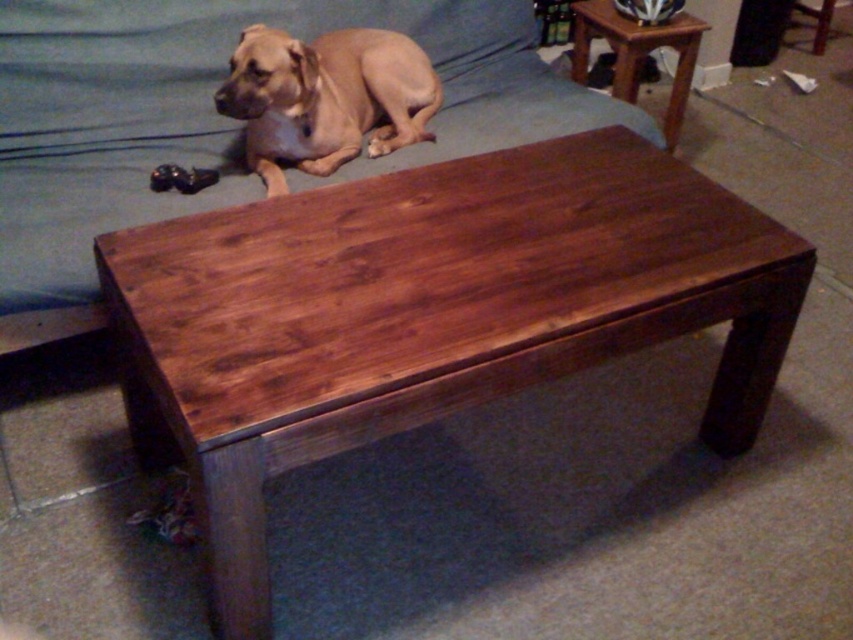
Is point (357, 426) positioned before point (386, 131)?

Yes, point (357, 426) is closer to viewer.

Between point (660, 330) and point (282, 65), which one is positioned behind?

Positioned behind is point (282, 65).

Measure the distance between dark brown wood table at center and camera.

dark brown wood table at center is 1.10 meters away from camera.

Image resolution: width=853 pixels, height=640 pixels. In order to click on dark brown wood table at center in this screenshot , I will do coord(426,314).

Between point (364, 349) and point (9, 140), which one is positioned in front?

Positioned in front is point (364, 349).

Is dark brown wood table at center to the right of brown wood couch at center from the viewer's perspective?

Correct, you'll find dark brown wood table at center to the right of brown wood couch at center.

Which is in front, point (231, 509) or point (12, 156)?

Point (231, 509)

Find the location of a particular element. This screenshot has width=853, height=640. dark brown wood table at center is located at coordinates (426, 314).

Does light brown fur at upper center have a lesser height compared to mahogany wood side table at upper right?

Yes, light brown fur at upper center is shorter than mahogany wood side table at upper right.

Who is higher up, light brown fur at upper center or mahogany wood side table at upper right?

mahogany wood side table at upper right

Does point (248, 125) lie behind point (585, 65)?

No, (248, 125) is in front of (585, 65).

I want to click on light brown fur at upper center, so click(325, 97).